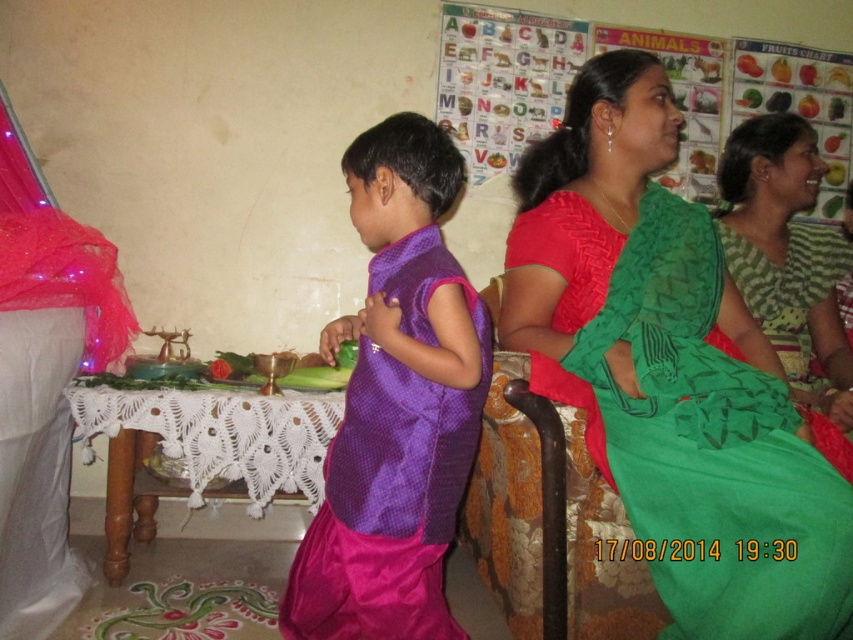
How much distance is there between green silk saree at center and purple silk sari at center?

green silk saree at center and purple silk sari at center are 14.54 inches apart from each other.

Find the location of a particular element. green silk saree at center is located at coordinates (711, 449).

Between point (660, 324) and point (376, 428), which one is positioned behind?

Point (376, 428)

The width and height of the screenshot is (853, 640). I want to click on green silk saree at center, so click(711, 449).

Does green silk saree at center appear on the left side of green woven sari at right?

Indeed, green silk saree at center is positioned on the left side of green woven sari at right.

How far apart are green silk saree at center and green woven sari at right?

They are 18.75 inches apart.

Measure the distance between green silk saree at center and camera.

They are 3.64 feet apart.

Locate an element on the screen. The width and height of the screenshot is (853, 640). green silk saree at center is located at coordinates (711, 449).

Based on the photo, is purple silk sari at center positioned behind white lace table at lower center?

No.

In the scene shown: Which is more to the left, purple silk sari at center or white lace table at lower center?

From the viewer's perspective, white lace table at lower center appears more on the left side.

This screenshot has width=853, height=640. I want to click on purple silk sari at center, so click(396, 404).

Locate an element on the screen. The height and width of the screenshot is (640, 853). purple silk sari at center is located at coordinates (396, 404).